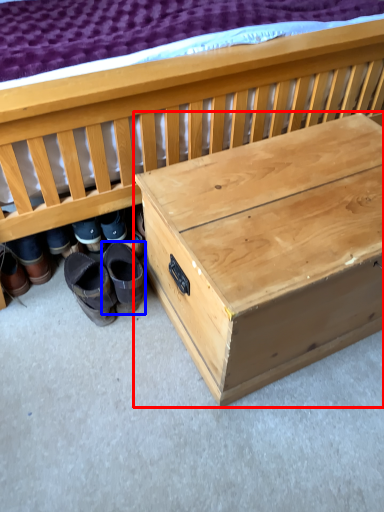
Question: Which point is closer to the camera, table (highlighted by a red box) or footwear (highlighted by a blue box)?

Choices:
 (A) table
 (B) footwear

Answer: (A)